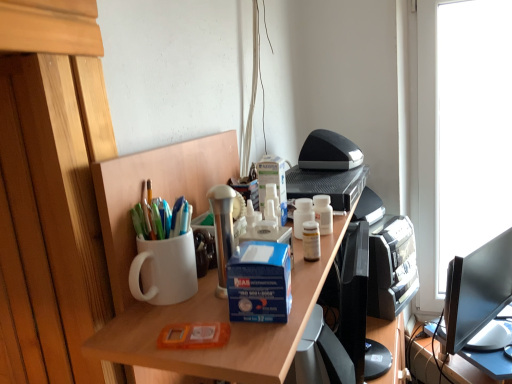
You are a GUI agent. You are given a task and a screenshot of the screen. Output one action in this format:
    pyautogui.click(x=<x>, y=<y>)
    Task: Click on the free point behind orange plastic case at center, positioned as the 1th stationery in left-to-right order
    Image resolution: width=512 pixels, height=384 pixels.
    Given the screenshot: What is the action you would take?
    pyautogui.click(x=209, y=297)